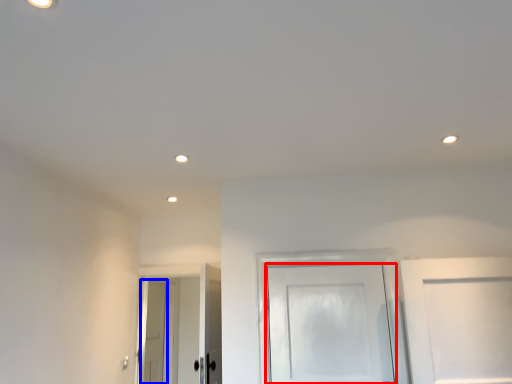
Question: Which point is further to the camera, door (highlighted by a red box) or door (highlighted by a blue box)?

Choices:
 (A) door
 (B) door

Answer: (B)